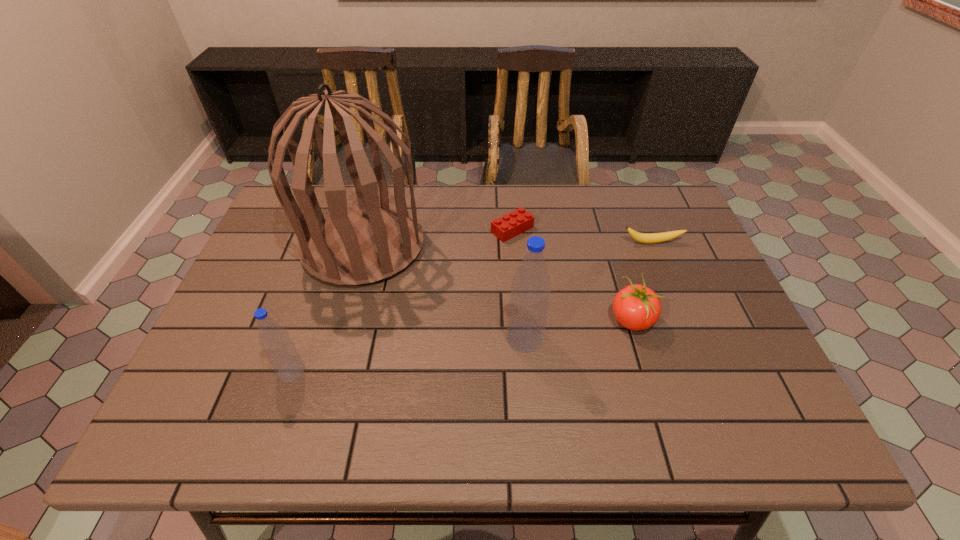
Locate an element on the screen. Image resolution: width=960 pixels, height=540 pixels. the shorter water bottle is located at coordinates (280, 350).

You are a GUI agent. You are given a task and a screenshot of the screen. Output one action in this format:
    pyautogui.click(x=<x>, y=<y>)
    Task: Click on the fourth shortest object
    This screenshot has width=960, height=540.
    Given the screenshot: What is the action you would take?
    pyautogui.click(x=280, y=350)

Image resolution: width=960 pixels, height=540 pixels. In order to click on the taller water bottle in this screenshot , I will do (x=528, y=308).

Image resolution: width=960 pixels, height=540 pixels. I want to click on the fifth shortest object, so click(528, 308).

The width and height of the screenshot is (960, 540). I want to click on Lego, so click(x=510, y=225).

The height and width of the screenshot is (540, 960). Identify the location of birdcage. (359, 244).

Locate an element on the screen. banana is located at coordinates (647, 238).

The width and height of the screenshot is (960, 540). What are the coordinates of `the fourth tallest object` in the screenshot? It's located at (636, 307).

This screenshot has width=960, height=540. Find the location of `vacant area located 0.340m on the back of the nearer water bottle`. vacant area located 0.340m on the back of the nearer water bottle is located at coordinates (330, 256).

Locate an element on the screen. The image size is (960, 540). blank area located on the right of the second tallest object is located at coordinates (608, 338).